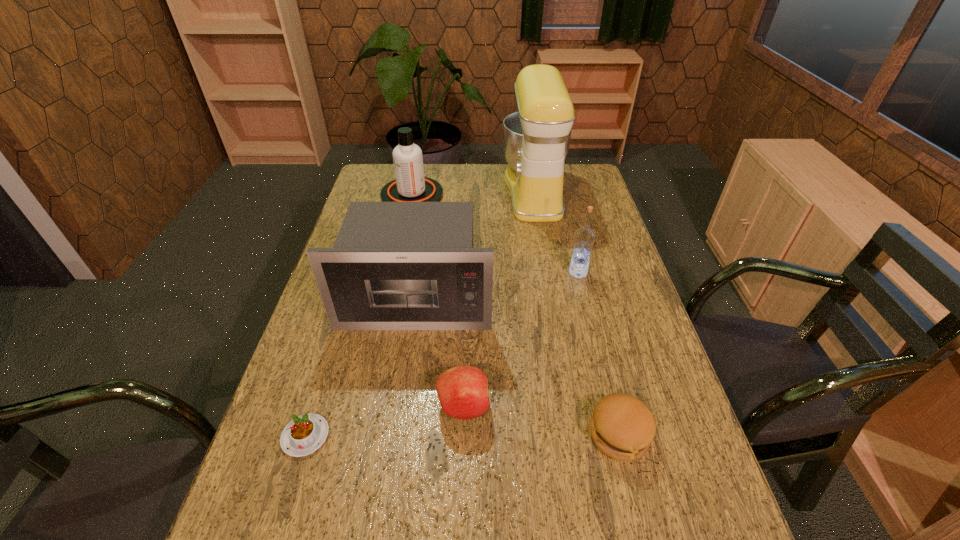
In order to click on the tallest object in this screenshot , I will do [536, 138].

I want to click on microwave oven, so click(394, 265).

This screenshot has width=960, height=540. In order to click on cleansing agent in this screenshot , I will do `click(410, 185)`.

The height and width of the screenshot is (540, 960). What are the coordinates of `vodka` in the screenshot? It's located at (584, 237).

The height and width of the screenshot is (540, 960). Identify the location of apple. (462, 390).

This screenshot has height=540, width=960. In order to click on hamburger in this screenshot , I will do `click(622, 426)`.

Where is `pudding`? This screenshot has height=540, width=960. pudding is located at coordinates (302, 436).

In order to click on vacant area situated 0.100m on the side of the tallest object with the control knob in this screenshot , I will do click(x=475, y=191).

The height and width of the screenshot is (540, 960). I want to click on free space located on the side of the tallest object with the control knob, so click(x=467, y=191).

Locate an element on the screen. vacant area situated 0.240m on the side of the tallest object with the control knob is located at coordinates (438, 191).